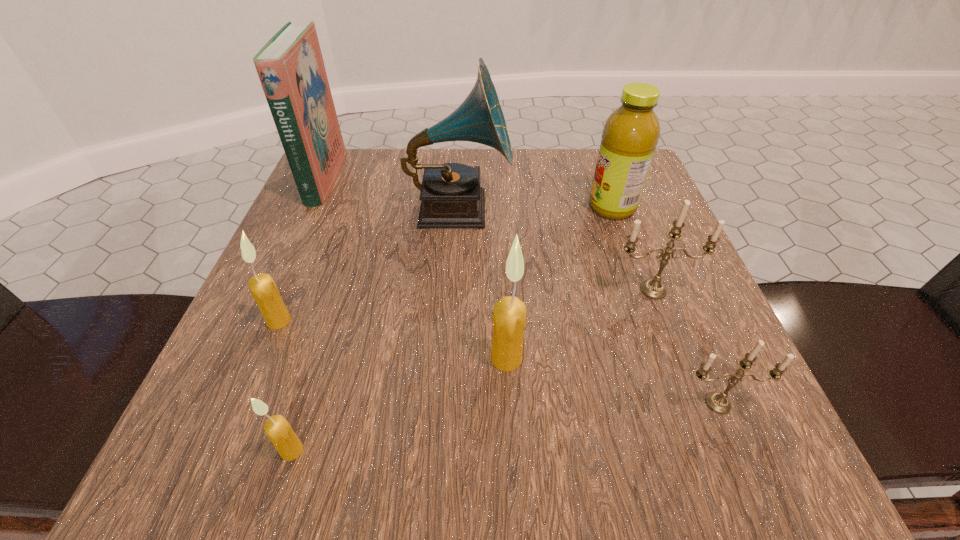
Locate an element on the screen. vacant space located 0.220m on the left of the farther metallic candle is located at coordinates (478, 290).

Identify the location of free region located 0.240m on the right of the nearest object. (497, 450).

Where is `free space located on the back of the smaller metallic candle`? This screenshot has width=960, height=540. free space located on the back of the smaller metallic candle is located at coordinates (660, 266).

Find the location of a particular element. This screenshot has width=960, height=540. hardback book present at the far edge is located at coordinates (290, 66).

Find the location of a particular element. This screenshot has height=540, width=960. phonograph_record that is positioned at the far edge is located at coordinates (451, 197).

Where is `fruit juice present at the far edge`? This screenshot has height=540, width=960. fruit juice present at the far edge is located at coordinates [x=630, y=135].

Locate an element on the screen. hardback book positioned at the left edge is located at coordinates (290, 66).

Locate an element on the screen. This screenshot has width=960, height=540. fruit juice at the right edge is located at coordinates (630, 135).

In order to click on object positioned at the far left corner in this screenshot , I will do `click(290, 66)`.

Locate an element on the screen. The height and width of the screenshot is (540, 960). object situated at the near left corner is located at coordinates (278, 430).